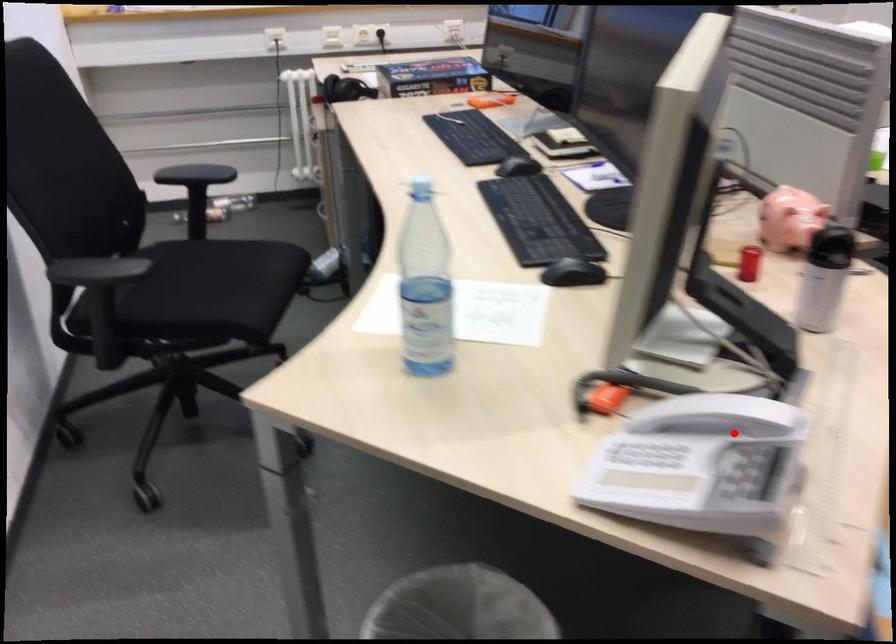
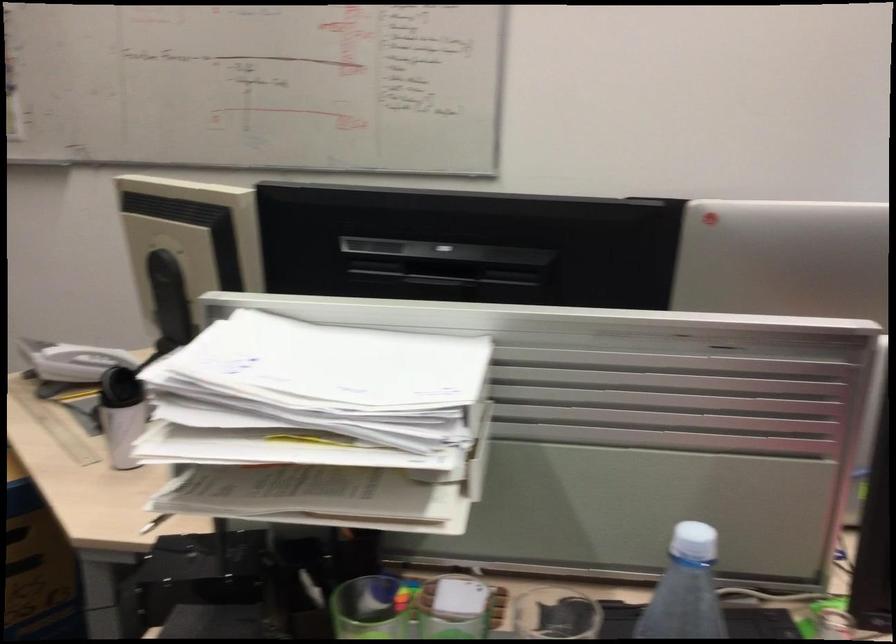
Where in the second image is the point corresponding to the highlighted location from the first image?

(82, 362)